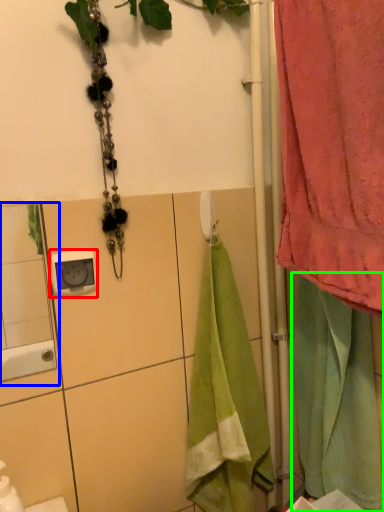
Question: Which object is positioned closest to electric outlet (highlighted by a red box)? Select from mirror (highlighted by a blue box) and beach towel (highlighted by a green box).

Choices:
 (A) mirror
 (B) beach towel

Answer: (B)